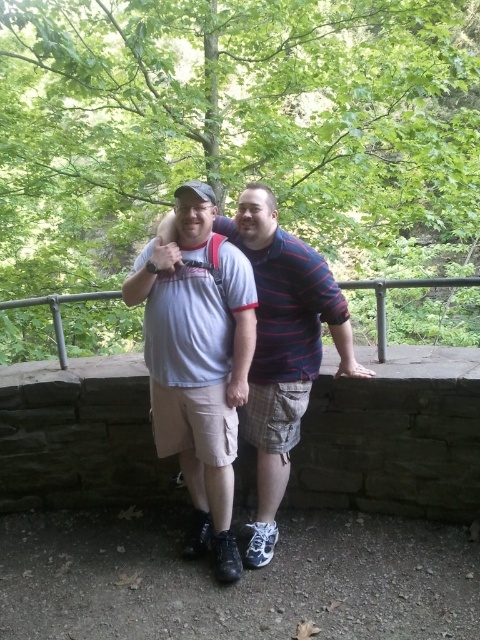
You are a photographer standing 10 feet away from the two people. You want to take a photo that includes both the white cotton shirt at center and the other person. Will you need to zoom in or out to ensure both are fully in the frame?

The two people are 7.75 feet apart. Since you are 10 feet away from them, you can zoom out slightly to ensure both the white cotton shirt at center and the other person are fully in the frame.

You are taking a photo of the two people in the park. You want to focus on the person on the right first and then the person on the left. Which point should you focus on first, point (302, 400) or point (377, 342)?

You should focus on point (302, 400) first because it is closer to the camera than point (377, 342).